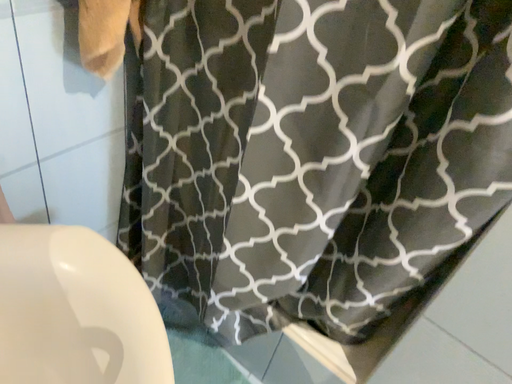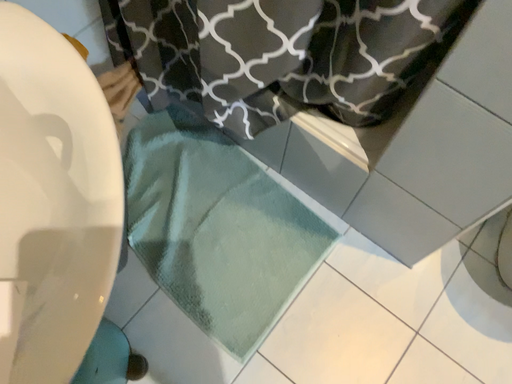
Question: How did the camera likely rotate when shooting the video?

Choices:
 (A) rotated downward
 (B) rotated upward

Answer: (A)